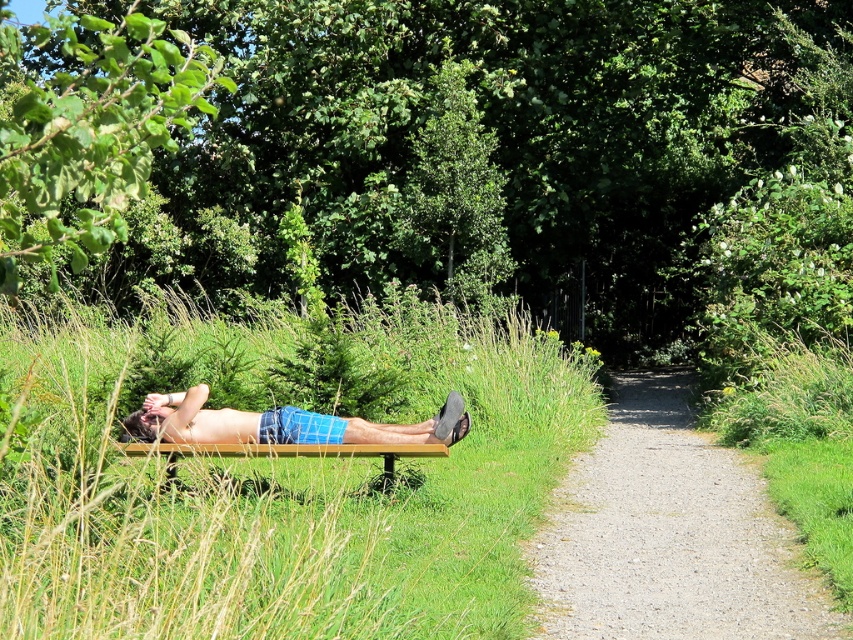
You are a photographer aiming to capture the man in blue plaid shorts at center while ensuring the green leafy tree at upper center is visible in the background. Can you position yourself in a way that both elements are in frame without moving the man?

Yes, the green leafy tree at upper center is located above the blue plaid shorts at center, so positioning the camera to include the upper part of the frame will allow both the man and the tree to be visible in the photo.

You are standing at the origin point in the image. Which direction should you move to reach the green leafy tree at center?

The green leafy tree at center is located at coordinates 0.303 on the x axis and 0.533 on the y axis. Since you are at the origin point, you should move right along the x axis to 0.303 and up along the y axis to 0.533 to reach it.

You are a photographer trying to capture the man in blue plaid shorts at center. To ensure the green leafy tree at center doesn not block your view, should you position yourself in front of or behind the tree?

The blue plaid shorts at center is behind the green leafy tree at center, so positioning yourself in front of the tree would allow you to see the shorts without obstruction.